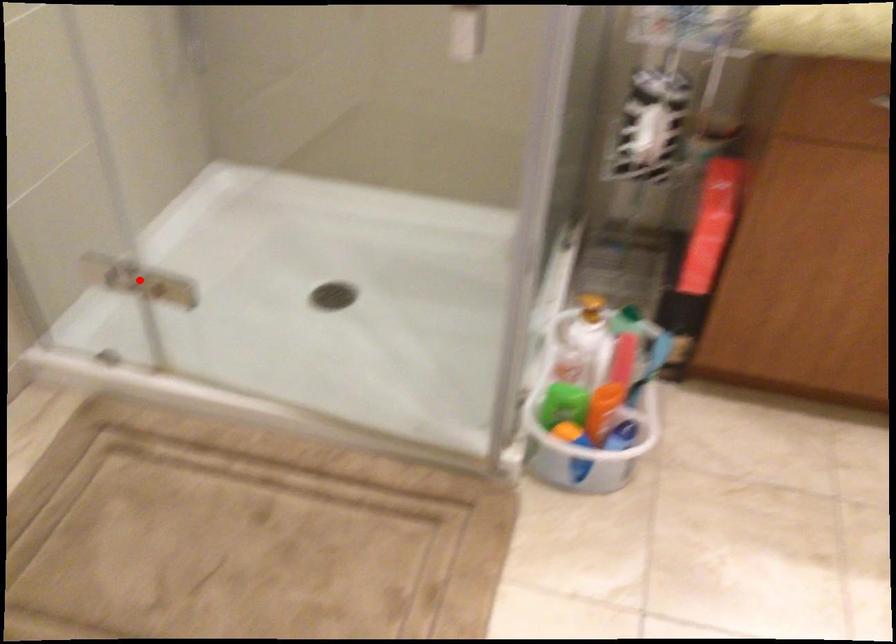
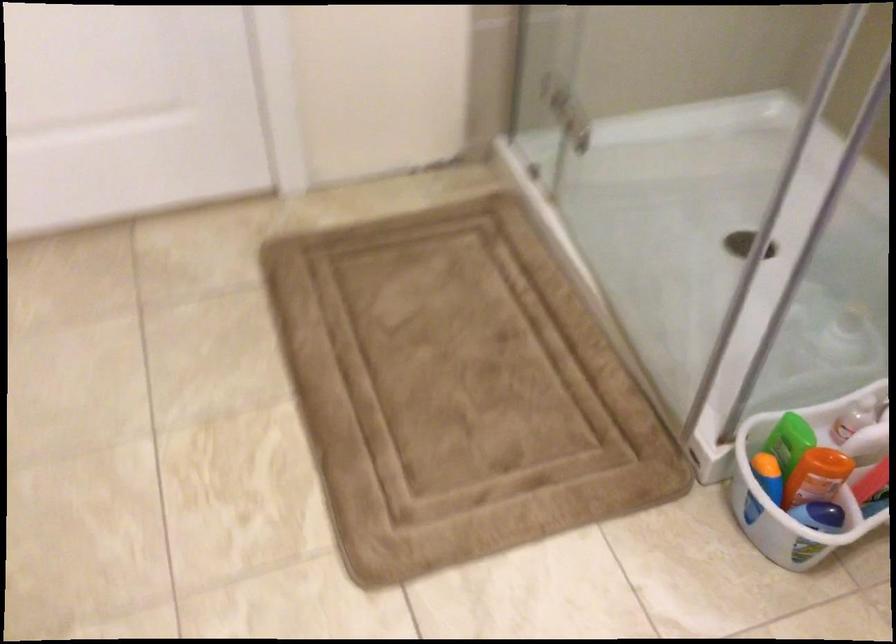
Find the pixel in the second image that matches the highlighted location in the first image.

(583, 107)